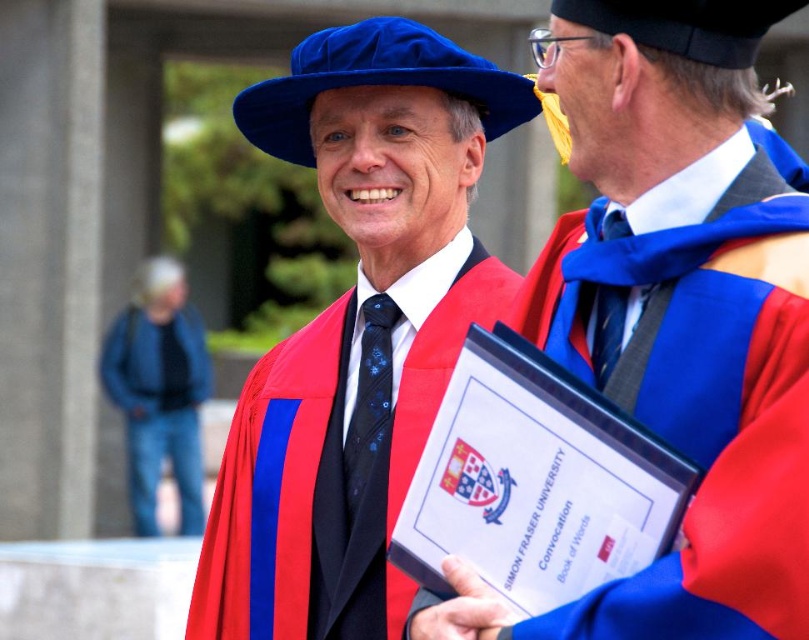
Question: Which point appears farthest from the camera in this image?

Choices:
 (A) (625, 240)
 (B) (390, 420)
 (C) (174, 397)

Answer: (C)

Question: Can you confirm if matte black tie at center is positioned to the right of blue denim jeans at lower left?

Choices:
 (A) no
 (B) yes

Answer: (B)

Question: Considering the real-world distances, which object is closest to the matte black suit at center?

Choices:
 (A) matte blue tie at upper right
 (B) black satin tie at center
 (C) blue denim jeans at lower left

Answer: (B)

Question: Considering the relative positions of blue denim jeans at lower left and black satin tie at center in the image provided, where is blue denim jeans at lower left located with respect to black satin tie at center?

Choices:
 (A) right
 (B) left

Answer: (B)

Question: Is matte black suit at center further to the viewer compared to blue denim jeans at lower left?

Choices:
 (A) yes
 (B) no

Answer: (B)

Question: Considering the real-world distances, which object is farthest from the matte black tie at center?

Choices:
 (A) matte blue tie at upper right
 (B) black satin tie at center
 (C) matte black suit at center

Answer: (B)